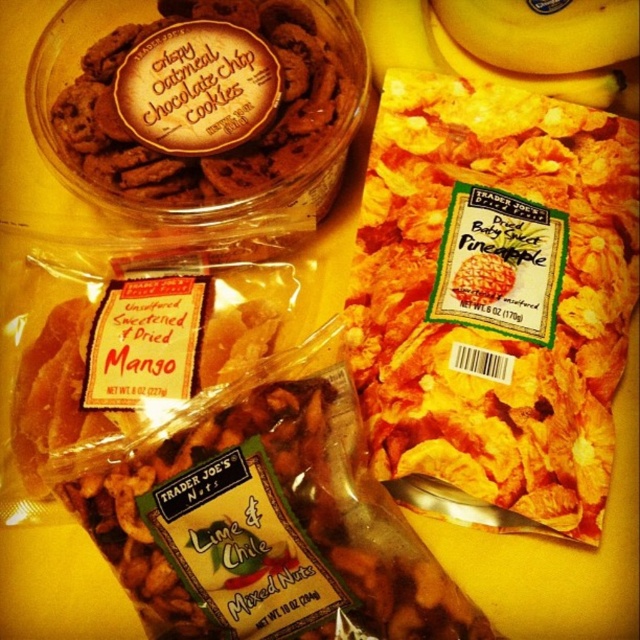
Question: Is yellow crunchy pineapple at upper right wider than crispy oatmeal chocolate chip cookies at upper left?

Choices:
 (A) yes
 (B) no

Answer: (B)

Question: Which of the following is the closest to the observer?

Choices:
 (A) (356, 308)
 (B) (234, 4)
 (C) (356, 3)

Answer: (B)

Question: Which of the following is the farthest from the observer?

Choices:
 (A) (440, 300)
 (B) (205, 161)
 (C) (420, 1)

Answer: (C)

Question: Is yellow crunchy pineapple at upper right thinner than crispy oatmeal chocolate chip cookies at upper left?

Choices:
 (A) yes
 (B) no

Answer: (A)

Question: Which of the following is the closest to the observer?

Choices:
 (A) (298, 44)
 (B) (506, 202)

Answer: (B)

Question: Does yellow crunchy pineapple at upper right appear on the left side of crispy oatmeal chocolate chip cookies at upper left?

Choices:
 (A) yes
 (B) no

Answer: (B)